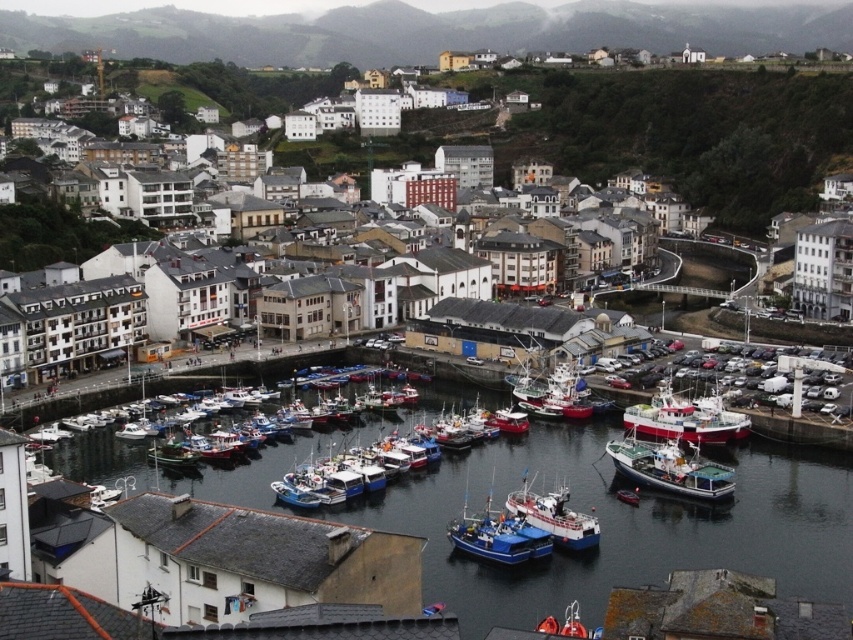
Looking at this image, you are standing at the point marked by coordinates point (51, 221) in the harbor scene. Looking around, you notice white matte buildings at center. Based on your position, which direction would you face to see the boats docked at the marina in the foreground?

Since point (51, 221) marks white matte buildings at center, facing towards the lower part of the image would direct you towards the boats docked at the marina in the foreground.

You are a tour guide leading a group from the white wooden boat at lower right towards the white matte buildings at center. The group wants to know if they can walk directly to the buildings without needing a vehicle. Can they?

The distance between the white matte buildings at center and the white wooden boat at lower right is 92.61 meters. Walking this distance would be possible, though it might be a moderately long walk depending on the group members.